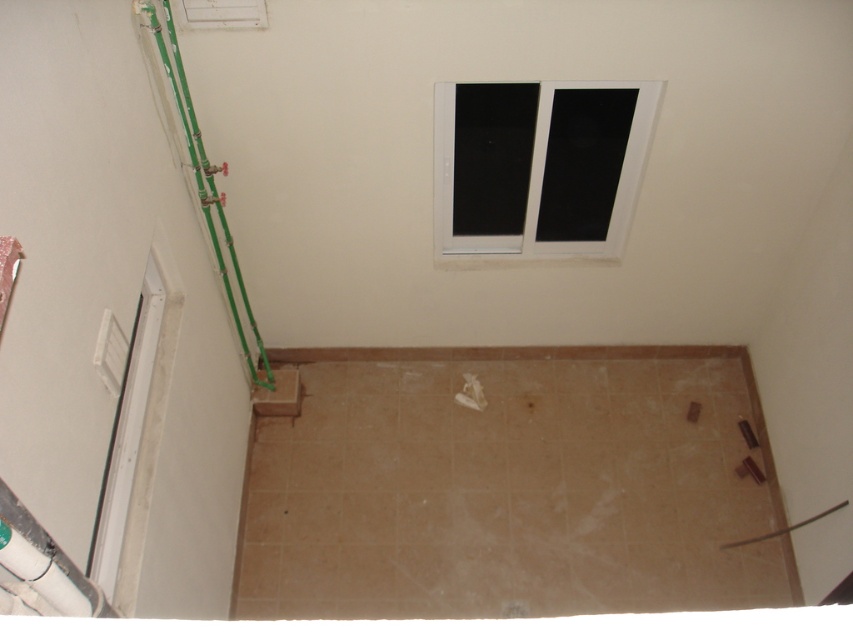
You are a contractor assessing the space. You need to know which object, the white plastic window at upper center or the green plastic pipes at left, requires more material to cover its surface. Which one would that be?

The white plastic window at upper center has a larger size compared to the green plastic pipes at left, so it would require more material to cover its surface.

You are a painter who needs to clean a window. You are standing on the ground and see the white plastic window at upper center. Can you reach it without a ladder?

The white plastic window at upper center is 2.53 meters from viewer, which is higher than the average human reach without a ladder. Therefore, you cannot reach it without a ladder.